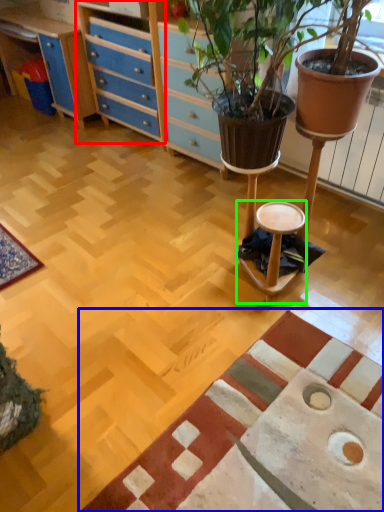
Question: Estimate the real-world distances between objects in this image. Which object is farther from file cabinet (highlighted by a red box), mat (highlighted by a blue box) or stool (highlighted by a green box)?

Choices:
 (A) mat
 (B) stool

Answer: (A)